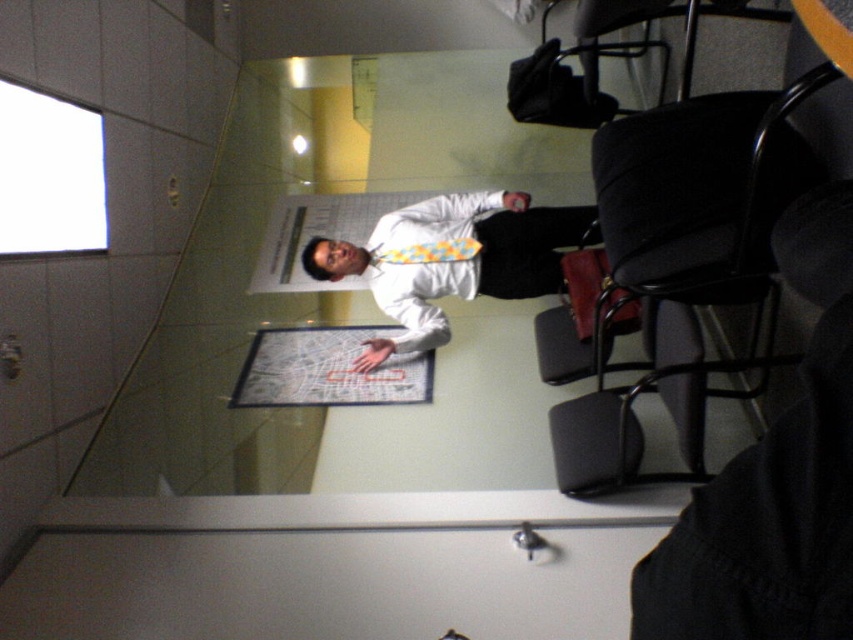
You are standing in a room with a glass partition. You see a man through the glass wearing a white shirt at center. Where exactly is the white glossy shirt at center located in relation to the point marked at coordinates [451,259]?

The point at coordinates [451,259] indicates the location of the white glossy shirt at center.

You are standing in a room separated by a glass partition from another room where a man in a white glossy shirt at center is presenting. If you want to hear his presentation clearly, do you need to move closer to the glass partition?

The white glossy shirt at center and viewer are 3.30 meters apart. To hear the presentation clearly, you should move closer to the glass partition to reduce the distance between you and the speaker.

You are standing in a room and see the white glossy shirt at center through a glass partition. If you want to touch the shirt directly, which direction should you move relative to your current position?

The white glossy shirt at center is located at point 0.406 on the x and 0.530 on the y coordinate, so you should move towards the center of the glass partition to reach it.